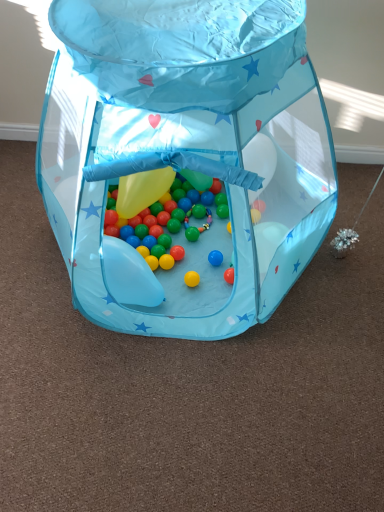
This screenshot has width=384, height=512. What do you see at coordinates (188, 149) in the screenshot? I see `shiny metallic ball at center` at bounding box center [188, 149].

The height and width of the screenshot is (512, 384). Identify the location of translucent plastic balloon at lower left. (129, 275).

Where is `shiny plastic beads at center`? This screenshot has height=512, width=384. shiny plastic beads at center is located at coordinates (172, 220).

Is translucent plastic balloon at lower left taller than shiny metallic ball at center?

In fact, translucent plastic balloon at lower left may be shorter than shiny metallic ball at center.

Are translucent plastic balloon at lower left and shiny metallic ball at center making contact?

No, translucent plastic balloon at lower left is not in contact with shiny metallic ball at center.

Is point (113, 276) more distant than point (72, 271)?

Yes, it is behind point (72, 271).

Between translucent plastic balloon at lower left and shiny plastic beads at center, which one appears on the right side from the viewer's perspective?

Positioned to the right is shiny plastic beads at center.

Looking at this image, considering the relative sizes of translucent plastic balloon at lower left and shiny plastic beads at center in the image provided, is translucent plastic balloon at lower left bigger than shiny plastic beads at center?

Indeed, translucent plastic balloon at lower left has a larger size compared to shiny plastic beads at center.

From a real-world perspective, between translucent plastic balloon at lower left and shiny plastic beads at center, who is vertically higher?

translucent plastic balloon at lower left, from a real-world perspective.

Is shiny plastic beads at center facing towards shiny metallic ball at center?

Yes.

Is shiny plastic beads at center surrounding shiny metallic ball at center?

Actually, shiny metallic ball at center is outside shiny plastic beads at center.

Looking at the image, does shiny plastic beads at center seem bigger or smaller compared to shiny metallic ball at center?

shiny plastic beads at center is smaller than shiny metallic ball at center.

Where is `toy on the left of shiny plastic beads at center`? The height and width of the screenshot is (512, 384). toy on the left of shiny plastic beads at center is located at coordinates (188, 149).

The height and width of the screenshot is (512, 384). Find the location of `candy below the translucent plastic balloon at lower left (from a real-world perspective)`. candy below the translucent plastic balloon at lower left (from a real-world perspective) is located at coordinates (172, 220).

Who is bigger, shiny plastic beads at center or translucent plastic balloon at lower left?

Bigger between the two is translucent plastic balloon at lower left.

Considering the relative positions of shiny plastic beads at center and translucent plastic balloon at lower left in the image provided, is shiny plastic beads at center to the right of translucent plastic balloon at lower left from the viewer's perspective?

Yes.

From a real-world perspective, does shiny plastic beads at center stand above translucent plastic balloon at lower left?

No, from a real-world perspective, shiny plastic beads at center is not above translucent plastic balloon at lower left.

From a real-world perspective, is shiny metallic ball at center positioned under translucent plastic balloon at lower left based on gravity?

No, from a real-world perspective, shiny metallic ball at center is not below translucent plastic balloon at lower left.

Considering the positions of objects shiny metallic ball at center and translucent plastic balloon at lower left in the image provided, who is in front, shiny metallic ball at center or translucent plastic balloon at lower left?

shiny metallic ball at center is more forward.

Is shiny metallic ball at center completely or partially outside of translucent plastic balloon at lower left?

Yes, shiny metallic ball at center is located beyond the bounds of translucent plastic balloon at lower left.

Would you consider shiny metallic ball at center to be distant from translucent plastic balloon at lower left?

That's not correct — shiny metallic ball at center is a little close to translucent plastic balloon at lower left.

Is shiny metallic ball at center positioned beyond the bounds of shiny plastic beads at center?

Absolutely, shiny metallic ball at center is external to shiny plastic beads at center.

In the scene shown: Considering the sizes of shiny metallic ball at center and shiny plastic beads at center in the image, is shiny metallic ball at center wider or thinner than shiny plastic beads at center?

Clearly, shiny metallic ball at center has more width compared to shiny plastic beads at center.

In the scene shown: From a real-world perspective, who is located higher, shiny metallic ball at center or shiny plastic beads at center?

In real-world perspective, shiny metallic ball at center is above.

Consider the image. Relative to shiny plastic beads at center, is shiny metallic ball at center in front or behind?

In the image, shiny metallic ball at center appears in front of shiny plastic beads at center.

You are a GUI agent. You are given a task and a screenshot of the screen. Output one action in this format:
    pyautogui.click(x=<x>, y=<y>)
    Task: Click on the balloon below the shiny metallic ball at center (from the image's perspective)
    
    Given the screenshot: What is the action you would take?
    pyautogui.click(x=129, y=275)

In the image, there is a translucent plastic balloon at lower left. Where is `candy below it (from a real-world perspective)`? candy below it (from a real-world perspective) is located at coordinates (172, 220).

Looking at the image, which one is located closer to shiny metallic ball at center, translucent plastic balloon at lower left or shiny plastic beads at center?

shiny plastic beads at center is positioned closer to the anchor shiny metallic ball at center.

In the scene shown: Looking at the image, which one is located further to translucent plastic balloon at lower left, shiny plastic beads at center or shiny metallic ball at center?

shiny metallic ball at center.

Based on their spatial positions, is translucent plastic balloon at lower left or shiny metallic ball at center further from shiny plastic beads at center?

shiny metallic ball at center is positioned further to the anchor shiny plastic beads at center.

Based on their spatial positions, is shiny plastic beads at center or translucent plastic balloon at lower left further from shiny metallic ball at center?

translucent plastic balloon at lower left.

Estimate the real-world distances between objects in this image. Which object is further from shiny plastic beads at center, shiny metallic ball at center or translucent plastic balloon at lower left?

Among the two, shiny metallic ball at center is located further to shiny plastic beads at center.

Consider the image. Considering their positions, is shiny metallic ball at center positioned closer to translucent plastic balloon at lower left than shiny plastic beads at center?

shiny plastic beads at center is positioned closer to the anchor translucent plastic balloon at lower left.

Identify the location of balloon positioned between shiny metallic ball at center and shiny plastic beads at center from near to far. (129, 275).